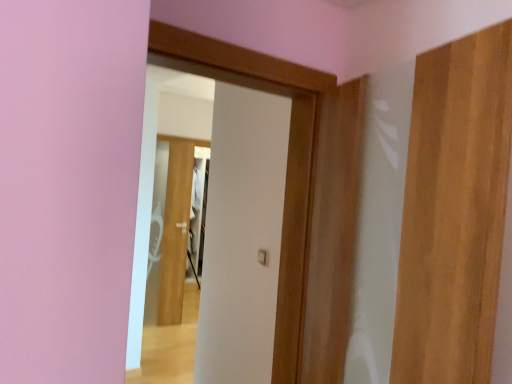
Question: Would you consider white glossy door at center, the first door positioned from the left, to be distant from white matte door at center, the 2th door when ordered from back to front?

Choices:
 (A) no
 (B) yes

Answer: (B)

Question: Is white glossy door at center, the 3th door viewed from the right, taller than white matte door at center, the 2th door when ordered from back to front?

Choices:
 (A) yes
 (B) no

Answer: (A)

Question: Is white glossy door at center, the first door positioned from the left, outside white matte door at center, the 2th door when ordered from back to front?

Choices:
 (A) no
 (B) yes

Answer: (B)

Question: From the image's perspective, does white glossy door at center, the third door viewed from the front, appear lower than white matte door at center, arranged as the second door when viewed from the front?

Choices:
 (A) yes
 (B) no

Answer: (A)

Question: Does white glossy door at center, the first door positioned from the left, come behind white matte door at center, arranged as the second door when viewed from the front?

Choices:
 (A) no
 (B) yes

Answer: (B)

Question: Considering the relative positions of white glossy door at center, the 3th door viewed from the right, and white matte door at center, arranged as the second door when viewed from the front, in the image provided, is white glossy door at center, the 3th door viewed from the right, to the right of white matte door at center, arranged as the second door when viewed from the front, from the viewer's perspective?

Choices:
 (A) yes
 (B) no

Answer: (B)

Question: From a real-world perspective, is white matte door at center, the second door in the right-to-left sequence, located beneath wooden door at right, the first door viewed from the right?

Choices:
 (A) yes
 (B) no

Answer: (A)

Question: Is white matte door at center, arranged as the second door when viewed from the front, aimed at wooden door at right, the first door viewed from the right?

Choices:
 (A) yes
 (B) no

Answer: (A)

Question: Considering the relative positions of white matte door at center, the second door in the right-to-left sequence, and wooden door at right, positioned as the 3th door in left-to-right order, in the image provided, is white matte door at center, the second door in the right-to-left sequence, in front of wooden door at right, positioned as the 3th door in left-to-right order,?

Choices:
 (A) yes
 (B) no

Answer: (B)

Question: Is white matte door at center, which ranks as the second door in left-to-right order, taller than wooden door at right, positioned as the 3th door in left-to-right order?

Choices:
 (A) no
 (B) yes

Answer: (B)

Question: Does white matte door at center, the 2th door when ordered from back to front, have a greater width compared to wooden door at right, positioned as the 3th door in left-to-right order?

Choices:
 (A) yes
 (B) no

Answer: (A)

Question: Is white matte door at center, the 2th door when ordered from back to front, outside of wooden door at right, acting as the 3th door starting from the back?

Choices:
 (A) yes
 (B) no

Answer: (A)

Question: Is wooden door at right, which is counted as the first door, starting from the front, beside white glossy door at center, the 3th door viewed from the right?

Choices:
 (A) yes
 (B) no

Answer: (B)